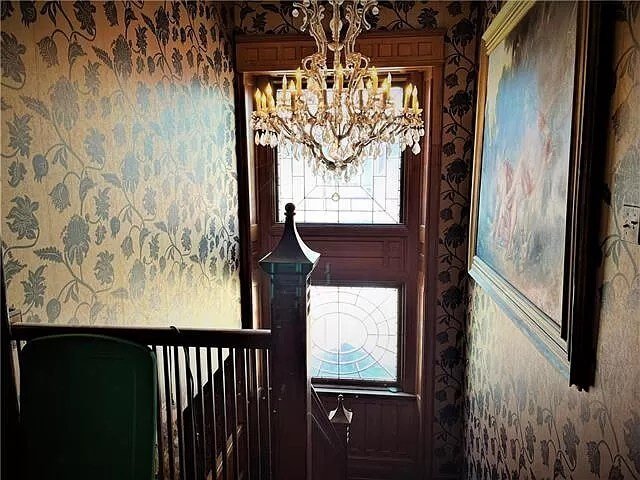
Where is `chandelier`? This screenshot has width=640, height=480. chandelier is located at coordinates (340, 121).